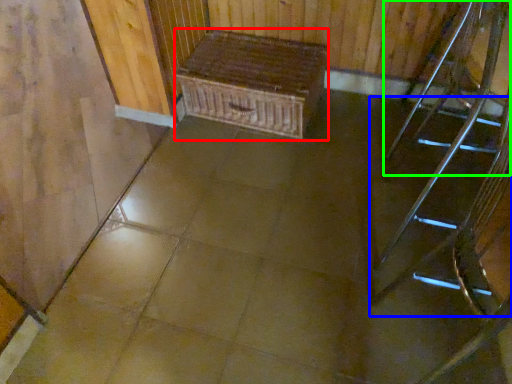
Question: Which is nearer to the furniture (highlighted by a red box)? stairs (highlighted by a blue box) or chair (highlighted by a green box).

Choices:
 (A) stairs
 (B) chair

Answer: (B)